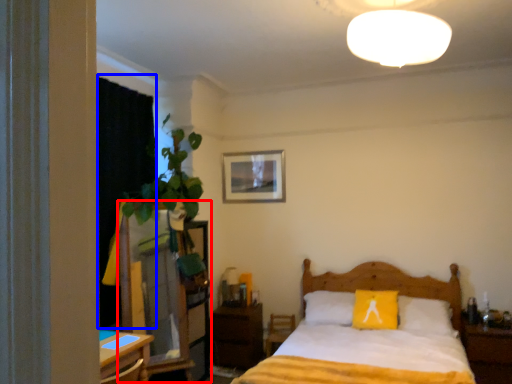
Question: Which of the following is the farthest to the observer, dresser (highlighted by a red box) or curtain (highlighted by a blue box)?

Choices:
 (A) dresser
 (B) curtain

Answer: (B)